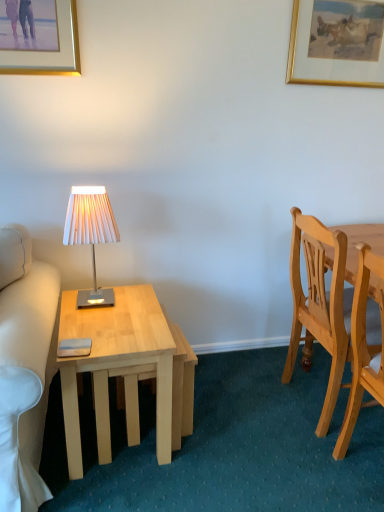
The width and height of the screenshot is (384, 512). What are the coordinates of `free spot to the left of light wood chair at right, which ranks as the first chair in front-to-back order` in the screenshot? It's located at (297, 474).